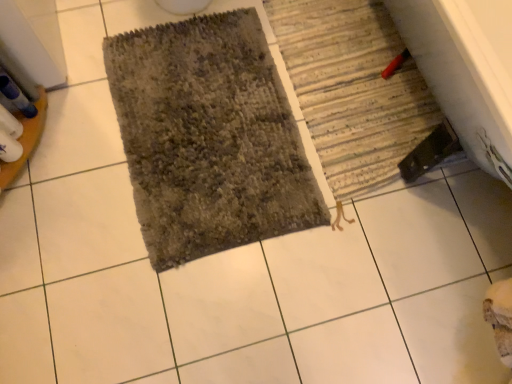
At what (x,y) coordinates should I click in order to perform the action: click on textured gray bath mat at center, the 1th bath mat viewed from the left. Please return your answer as a coordinate pair (x, y). Looking at the image, I should click on (x=209, y=137).

This screenshot has width=512, height=384. What do you see at coordinates (209, 137) in the screenshot?
I see `textured gray bath mat at center, the 1th bath mat viewed from the left` at bounding box center [209, 137].

In order to click on striped fabric bath mat at lower right, which is the first bath mat in right-to-left order in this screenshot , I will do `click(353, 89)`.

Describe the element at coordinates (353, 89) in the screenshot. The height and width of the screenshot is (384, 512). I see `striped fabric bath mat at lower right, the second bath mat viewed from the left` at that location.

Locate an element on the screen. textured gray bath mat at center, which is the 2th bath mat in right-to-left order is located at coordinates (209, 137).

Looking at this image, considering the relative positions of striped fabric bath mat at lower right, the second bath mat viewed from the left, and textured gray bath mat at center, which is the 2th bath mat in right-to-left order, in the image provided, is striped fabric bath mat at lower right, the second bath mat viewed from the left, to the right of textured gray bath mat at center, which is the 2th bath mat in right-to-left order, from the viewer's perspective?

Indeed, striped fabric bath mat at lower right, the second bath mat viewed from the left, is positioned on the right side of textured gray bath mat at center, which is the 2th bath mat in right-to-left order.

Does striped fabric bath mat at lower right, the second bath mat viewed from the left, lie behind textured gray bath mat at center, the 1th bath mat viewed from the left?

Yes.

Does point (358, 73) come closer to viewer compared to point (285, 213)?

No, it is not.

From the image's perspective, is striped fabric bath mat at lower right, the second bath mat viewed from the left, on textured gray bath mat at center, the 1th bath mat viewed from the left?

Yes.

Consider the image. From a real-world perspective, relative to textured gray bath mat at center, the 1th bath mat viewed from the left, is striped fabric bath mat at lower right, the second bath mat viewed from the left, vertically above or below?

Clearly, from a real-world perspective, striped fabric bath mat at lower right, the second bath mat viewed from the left, is above textured gray bath mat at center, the 1th bath mat viewed from the left.

Does striped fabric bath mat at lower right, which is the first bath mat in right-to-left order, have a greater width compared to textured gray bath mat at center, which is the 2th bath mat in right-to-left order?

No.

Looking at this image, does striped fabric bath mat at lower right, which is the first bath mat in right-to-left order, have a greater height compared to textured gray bath mat at center, which is the 2th bath mat in right-to-left order?

Indeed, striped fabric bath mat at lower right, which is the first bath mat in right-to-left order, has a greater height compared to textured gray bath mat at center, which is the 2th bath mat in right-to-left order.

Is striped fabric bath mat at lower right, which is the first bath mat in right-to-left order, bigger than textured gray bath mat at center, the 1th bath mat viewed from the left?

Actually, striped fabric bath mat at lower right, which is the first bath mat in right-to-left order, might be smaller than textured gray bath mat at center, the 1th bath mat viewed from the left.

Is textured gray bath mat at center, which is the 2th bath mat in right-to-left order, surrounded by striped fabric bath mat at lower right, the second bath mat viewed from the left?

Actually, textured gray bath mat at center, which is the 2th bath mat in right-to-left order, is outside striped fabric bath mat at lower right, the second bath mat viewed from the left.

In the scene shown: Is striped fabric bath mat at lower right, the second bath mat viewed from the left, looking in the opposite direction of textured gray bath mat at center, which is the 2th bath mat in right-to-left order?

striped fabric bath mat at lower right, the second bath mat viewed from the left, does not have its back to textured gray bath mat at center, which is the 2th bath mat in right-to-left order.

How many degrees apart are the facing directions of striped fabric bath mat at lower right, which is the first bath mat in right-to-left order, and textured gray bath mat at center, which is the 2th bath mat in right-to-left order?

The angular difference between striped fabric bath mat at lower right, which is the first bath mat in right-to-left order, and textured gray bath mat at center, which is the 2th bath mat in right-to-left order, is 90 degrees.

How distant is striped fabric bath mat at lower right, the second bath mat viewed from the left, from textured gray bath mat at center, the 1th bath mat viewed from the left?

The distance of striped fabric bath mat at lower right, the second bath mat viewed from the left, from textured gray bath mat at center, the 1th bath mat viewed from the left, is 27.44 centimeters.

Where is `bath mat that is above the textured gray bath mat at center, the 1th bath mat viewed from the left (from a real-world perspective)`? The image size is (512, 384). bath mat that is above the textured gray bath mat at center, the 1th bath mat viewed from the left (from a real-world perspective) is located at coordinates (353, 89).

Which object is positioned more to the right, textured gray bath mat at center, which is the 2th bath mat in right-to-left order, or striped fabric bath mat at lower right, which is the first bath mat in right-to-left order?

striped fabric bath mat at lower right, which is the first bath mat in right-to-left order.

Considering the relative positions of textured gray bath mat at center, which is the 2th bath mat in right-to-left order, and striped fabric bath mat at lower right, which is the first bath mat in right-to-left order, in the image provided, is textured gray bath mat at center, which is the 2th bath mat in right-to-left order, in front of striped fabric bath mat at lower right, which is the first bath mat in right-to-left order,?

Yes, it is in front of striped fabric bath mat at lower right, which is the first bath mat in right-to-left order.

Is point (198, 60) more distant than point (436, 117)?

Yes, point (198, 60) is behind point (436, 117).

From the image's perspective, is textured gray bath mat at center, the 1th bath mat viewed from the left, over striped fabric bath mat at lower right, the second bath mat viewed from the left?

No, from the image's perspective, textured gray bath mat at center, the 1th bath mat viewed from the left, is not on top of striped fabric bath mat at lower right, the second bath mat viewed from the left.

From a real-world perspective, does textured gray bath mat at center, the 1th bath mat viewed from the left, stand above striped fabric bath mat at lower right, which is the first bath mat in right-to-left order?

No, from a real-world perspective, textured gray bath mat at center, the 1th bath mat viewed from the left, is not on top of striped fabric bath mat at lower right, which is the first bath mat in right-to-left order.

Between textured gray bath mat at center, the 1th bath mat viewed from the left, and striped fabric bath mat at lower right, the second bath mat viewed from the left, which one has larger width?

With larger width is textured gray bath mat at center, the 1th bath mat viewed from the left.

Does textured gray bath mat at center, which is the 2th bath mat in right-to-left order, have a greater height compared to striped fabric bath mat at lower right, which is the first bath mat in right-to-left order?

No.

Based on their sizes in the image, would you say textured gray bath mat at center, which is the 2th bath mat in right-to-left order, is bigger or smaller than striped fabric bath mat at lower right, the second bath mat viewed from the left?

In the image, textured gray bath mat at center, which is the 2th bath mat in right-to-left order, appears to be larger than striped fabric bath mat at lower right, the second bath mat viewed from the left.

Is striped fabric bath mat at lower right, the second bath mat viewed from the left, located within textured gray bath mat at center, the 1th bath mat viewed from the left?

No, striped fabric bath mat at lower right, the second bath mat viewed from the left, is not surrounded by textured gray bath mat at center, the 1th bath mat viewed from the left.

Is there a large distance between textured gray bath mat at center, which is the 2th bath mat in right-to-left order, and striped fabric bath mat at lower right, the second bath mat viewed from the left?

textured gray bath mat at center, which is the 2th bath mat in right-to-left order, is actually quite close to striped fabric bath mat at lower right, the second bath mat viewed from the left.

Consider the image. Could you tell me if textured gray bath mat at center, which is the 2th bath mat in right-to-left order, is turned towards striped fabric bath mat at lower right, which is the first bath mat in right-to-left order?

No, textured gray bath mat at center, which is the 2th bath mat in right-to-left order, is not oriented towards striped fabric bath mat at lower right, which is the first bath mat in right-to-left order.

How different are the orientations of textured gray bath mat at center, which is the 2th bath mat in right-to-left order, and striped fabric bath mat at lower right, the second bath mat viewed from the left, in degrees?

90 degrees.

Measure the distance from textured gray bath mat at center, which is the 2th bath mat in right-to-left order, to striped fabric bath mat at lower right, which is the first bath mat in right-to-left order.

A distance of 10.80 inches exists between textured gray bath mat at center, which is the 2th bath mat in right-to-left order, and striped fabric bath mat at lower right, which is the first bath mat in right-to-left order.

In the image, there is a textured gray bath mat at center, which is the 2th bath mat in right-to-left order. Identify the location of bath mat above it (from the image's perspective). (353, 89).

Where is `bath mat above the textured gray bath mat at center, which is the 2th bath mat in right-to-left order (from a real-world perspective)`? The width and height of the screenshot is (512, 384). bath mat above the textured gray bath mat at center, which is the 2th bath mat in right-to-left order (from a real-world perspective) is located at coordinates (353, 89).

The width and height of the screenshot is (512, 384). I want to click on bath mat lying below the striped fabric bath mat at lower right, which is the first bath mat in right-to-left order (from the image's perspective), so click(209, 137).